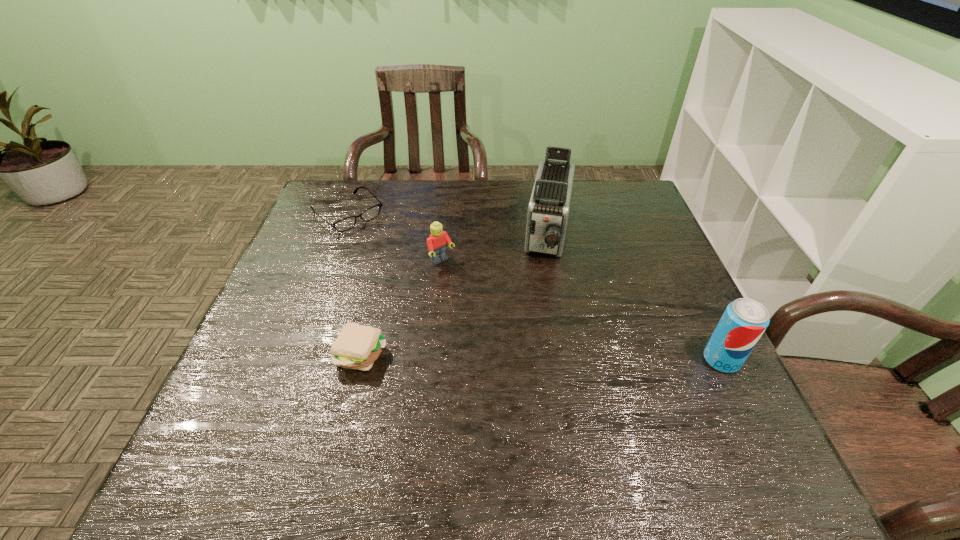
Identify the location of the fourth tallest object. The height and width of the screenshot is (540, 960). (357, 347).

Locate an element on the screen. the rightmost object is located at coordinates (742, 324).

The width and height of the screenshot is (960, 540). Identify the location of soda can. (742, 324).

This screenshot has width=960, height=540. What are the coordinates of `Lego` in the screenshot? It's located at (437, 242).

Identify the location of the third shortest object. Image resolution: width=960 pixels, height=540 pixels. (437, 242).

The height and width of the screenshot is (540, 960). I want to click on camcorder, so click(548, 210).

The width and height of the screenshot is (960, 540). I want to click on the fourth object from left to right, so click(548, 210).

Locate an element on the screen. This screenshot has height=540, width=960. spectacles is located at coordinates (344, 224).

At what (x,y) coordinates should I click in order to perform the action: click on vacant space situated on the right of the patty. Please return your answer as a coordinate pair (x, y). Looking at the image, I should click on (566, 354).

Find the location of a particular element. The image size is (960, 540). vacant space located 0.360m on the back of the soda can is located at coordinates (665, 244).